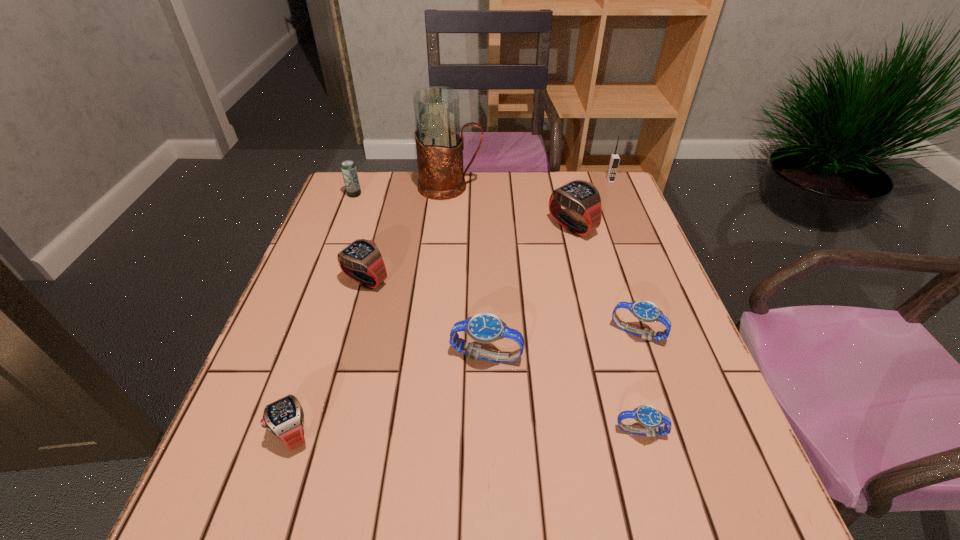
Locate an element on the screen. This screenshot has height=540, width=960. vacant position located on the front of the second smallest blue watch is located at coordinates (657, 393).

At what (x,y) coordinates should I click in order to perform the action: click on free point located 0.100m on the back of the nearest red watch. Please return your answer as a coordinate pair (x, y). This screenshot has width=960, height=540. Looking at the image, I should click on (316, 366).

Where is `vacant space located 0.060m on the front of the shortest object`? The width and height of the screenshot is (960, 540). vacant space located 0.060m on the front of the shortest object is located at coordinates (654, 479).

I want to click on pitcher at the far edge, so click(x=439, y=146).

Locate an element on the screen. The height and width of the screenshot is (540, 960). cellular telephone that is at the far edge is located at coordinates (614, 159).

Locate an element on the screen. The height and width of the screenshot is (540, 960). watch that is at the far edge is located at coordinates (579, 196).

Find the location of a particular element. Image resolution: width=960 pixels, height=540 pixels. beer can at the far edge is located at coordinates (348, 168).

I want to click on beer can positioned at the left edge, so click(348, 168).

The width and height of the screenshot is (960, 540). I want to click on cellular telephone situated at the right edge, so click(x=614, y=159).

The image size is (960, 540). Find the location of `object that is at the far left corner`. object that is at the far left corner is located at coordinates (348, 168).